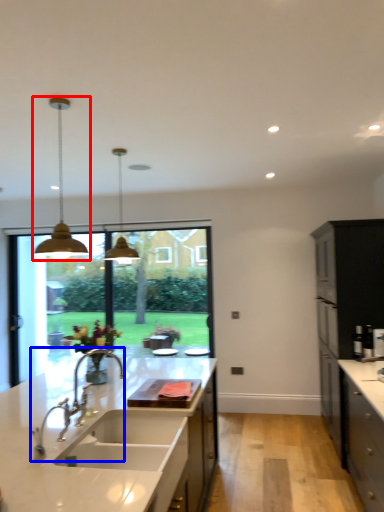
Question: Which object appears closest to the camera in this image, lamp (highlighted by a red box) or tap (highlighted by a blue box)?

Choices:
 (A) lamp
 (B) tap

Answer: (B)